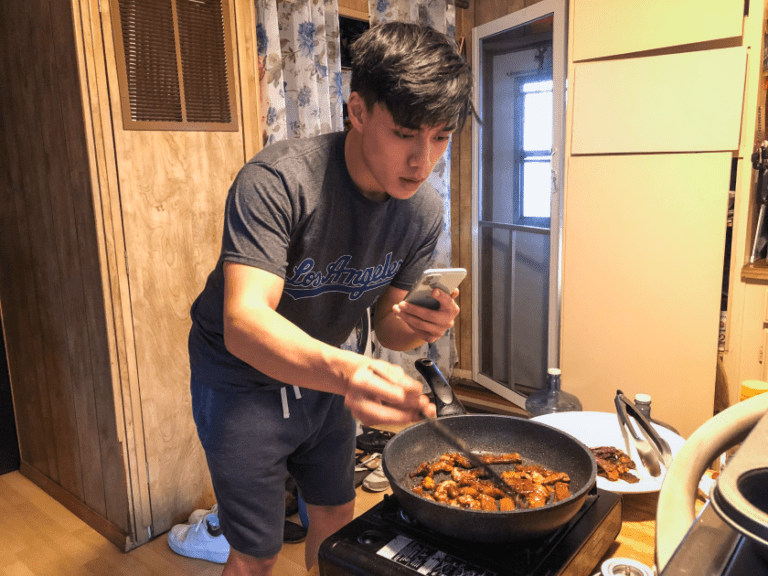
You are a GUI agent. You are given a task and a screenshot of the screen. Output one action in this format:
    pyautogui.click(x=<x>, y=<y>)
    Task: Click on the cooking pan
    This screenshot has height=576, width=768.
    Given the screenshot: What is the action you would take?
    pyautogui.click(x=396, y=452)